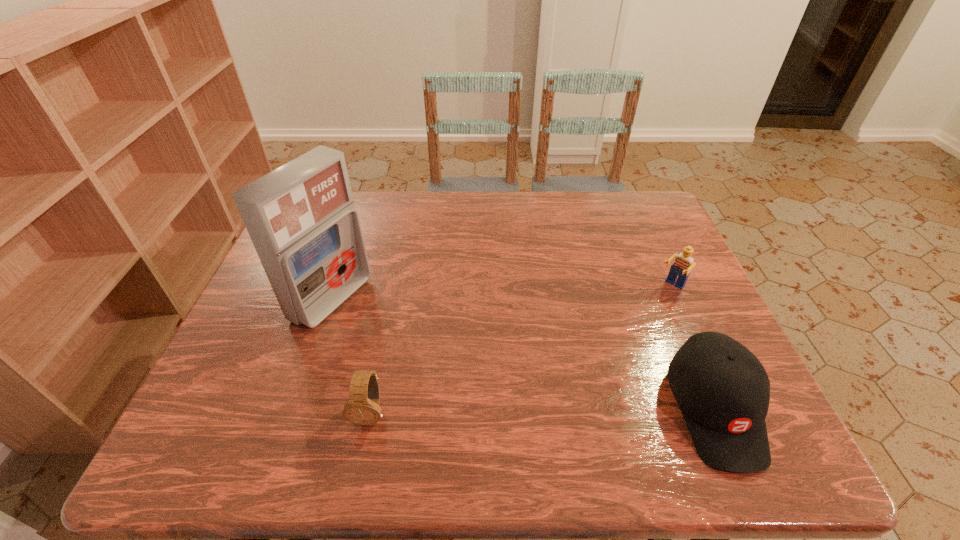
Image resolution: width=960 pixels, height=540 pixels. I want to click on vacant position located on the face of the Lego, so click(589, 368).

Image resolution: width=960 pixels, height=540 pixels. I want to click on watch positioned at the near edge, so click(x=362, y=408).

In order to click on baseball cap present at the near edge in this screenshot , I will do `click(723, 391)`.

I want to click on object present at the left edge, so point(301,218).

Find the location of `baseball cap that is positioned at the right edge`. baseball cap that is positioned at the right edge is located at coordinates (723, 391).

Identify the location of Lego at the right edge. [x=683, y=264].

Locate an element on the screen. object present at the near right corner is located at coordinates (723, 391).

The height and width of the screenshot is (540, 960). In the image, there is a desktop. Identify the location of vacant space at the far edge. (549, 213).

In the image, there is a desktop. In order to click on blank space at the near edge in this screenshot , I will do `click(566, 399)`.

This screenshot has width=960, height=540. In order to click on free space at the left edge of the desktop in this screenshot , I will do `click(291, 372)`.